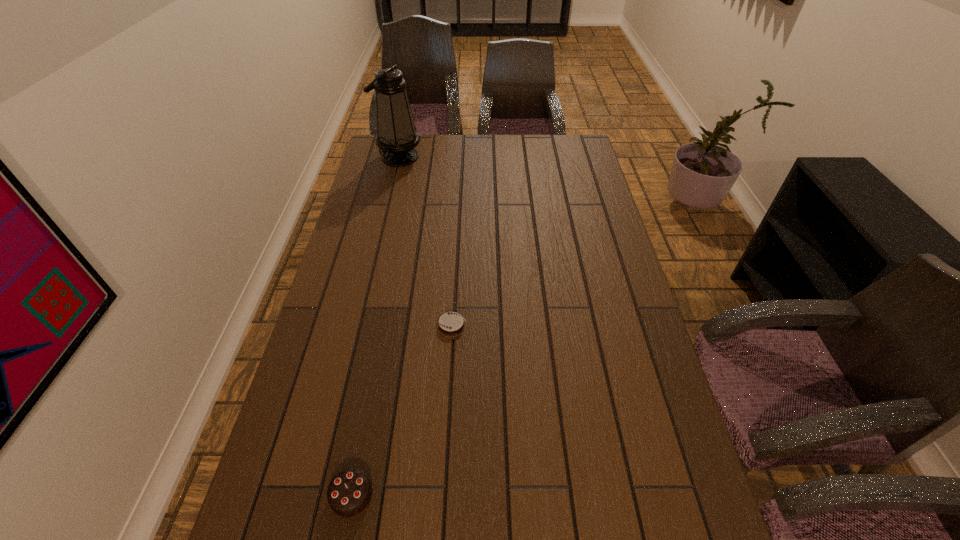
Find the location of `oil lamp`. oil lamp is located at coordinates (397, 137).

I want to click on the tallest object, so click(x=397, y=137).

The image size is (960, 540). What are the coordinates of `the nearer chocolate cake` in the screenshot? It's located at (349, 492).

You are a GUI agent. You are given a task and a screenshot of the screen. Output one action in this format:
    pyautogui.click(x=<x>, y=<y>)
    Task: Click on the taller chocolate cake
    This screenshot has width=960, height=540.
    Given the screenshot: What is the action you would take?
    pyautogui.click(x=349, y=492)

This screenshot has height=540, width=960. In order to click on the second nearest object in this screenshot , I will do `click(451, 324)`.

Locate an element on the screen. the shorter chocolate cake is located at coordinates (451, 324).

The height and width of the screenshot is (540, 960). I want to click on vacant space located 0.170m on the right of the farthest object, so click(463, 157).

Locate an element on the screen. vacant space located on the left of the left chocolate cake is located at coordinates (263, 495).

The height and width of the screenshot is (540, 960). Find the location of `vacant space located 0.400m on the right of the shortest object`. vacant space located 0.400m on the right of the shortest object is located at coordinates (612, 325).

Identify the location of object positioned at the far edge. The height and width of the screenshot is (540, 960). (397, 137).